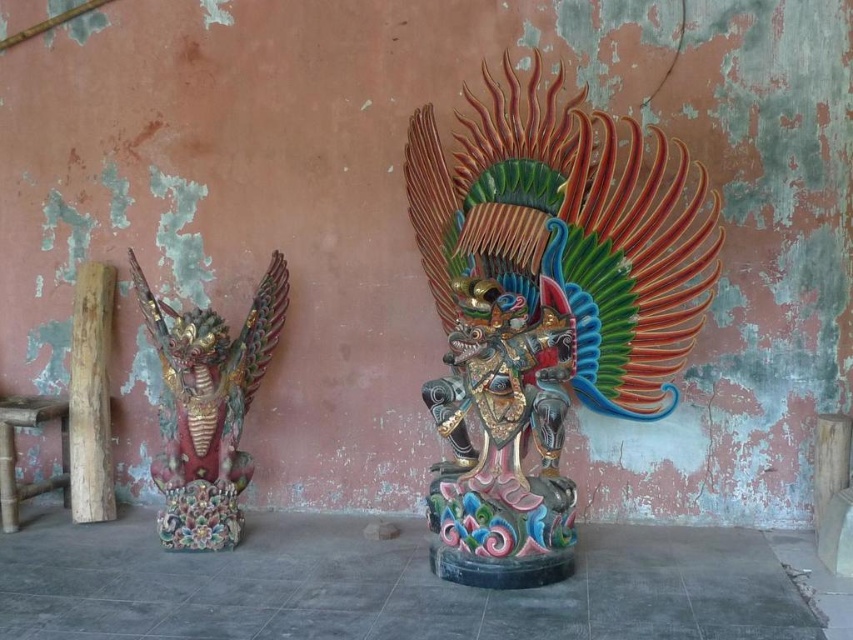
You are an art conservator examining the statues. The polychrome wood carving at left has a point at coordinates [207,406]. What does this coordinate indicate about its position relative to the larger statue on the right?

The coordinate point [207,406] indicates that the polychrome wood carving at left is positioned to the left of the larger statue on the right.

You are an art conservator examining the statues against the weathered wall. You need to assess which object is positioned higher. Which one is located above the other between the polychrome wood carving at left and the natural wood log at left?

The polychrome wood carving at left is above the natural wood log at left according to the description.

You are an art conservator assessing the statues in the image. You need to determine which object is taller between the polychrome wood carving at left and the natural wood log at left. Based on the scene, which one is taller?

The polychrome wood carving at left has a greater height compared to the natural wood log at left, so the polychrome wood carving at left is taller.